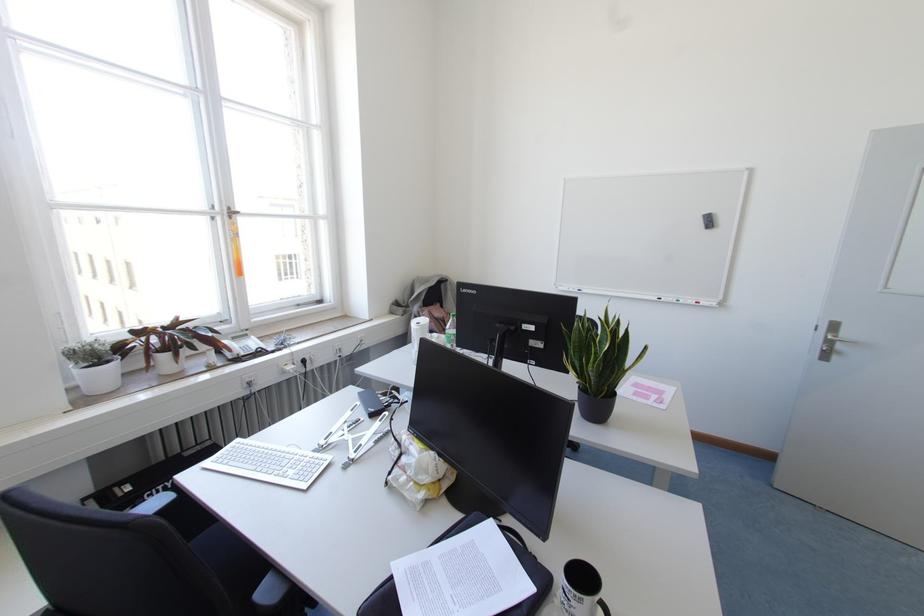
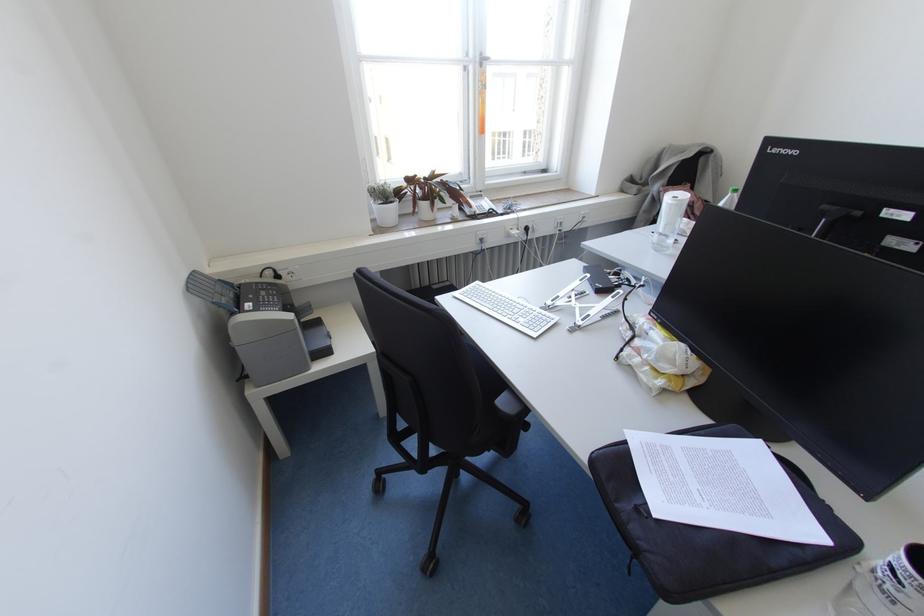
Find the pixel in the second image that matches pixel 258 349 in the first image.

(490, 209)